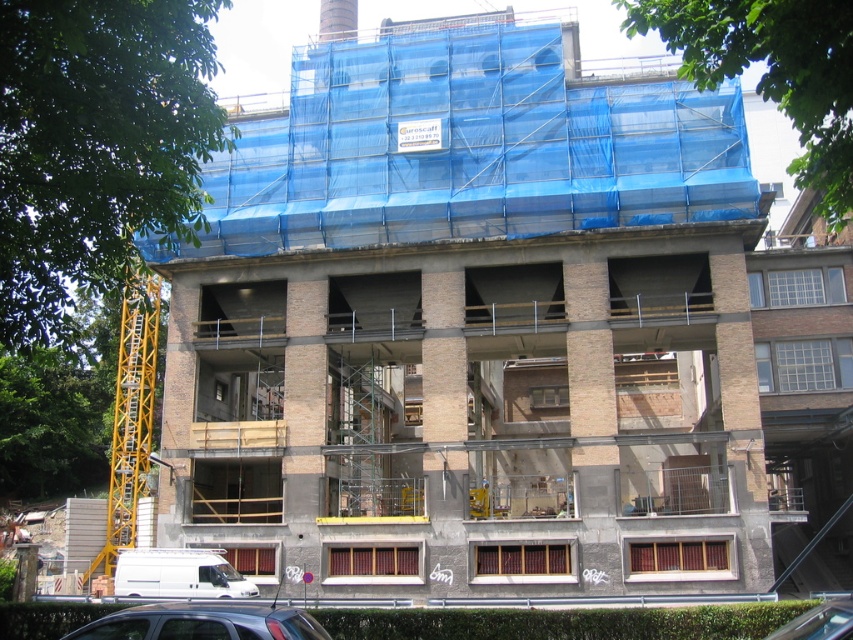
You are a delivery driver who needs to park your vehicle in the garage area shown in the image. The garage has limited space. Which vehicle, the white matte van at lower left or the metallic silver car at lower right, would require less space to park?

The white matte van at lower left is shorter than the metallic silver car at lower right, so the white matte van at lower left would require less space to park.

You are standing at the entrance of the building and want to park your matte black car at lower center. According to the coordinates provided, where should you position your car?

The matte black car at lower center should be positioned at point coordinates of (202, 621).

You are a delivery driver who needs to park your car in the garage. You see a matte black car at lower center and a metallic silver car at lower right. Which car is blocking the entrance to the garage?

The metallic silver car at lower right is behind the matte black car at lower center, so the matte black car at lower center is blocking the entrance to the garage.